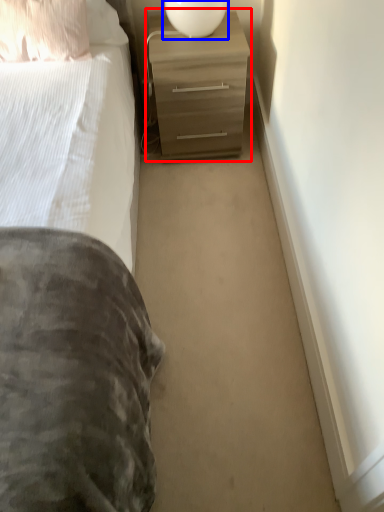
Question: Which point is closer to the camera, chest of drawers (highlighted by a red box) or table lamp (highlighted by a blue box)?

Choices:
 (A) chest of drawers
 (B) table lamp

Answer: (B)